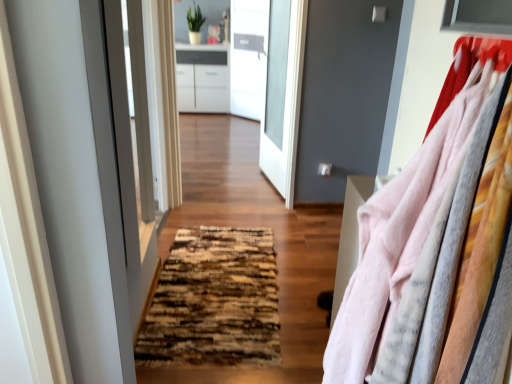
Question: From the image's perspective, does matte white screen door at center appear higher than brown textured rug at center?

Choices:
 (A) no
 (B) yes

Answer: (B)

Question: Is matte white screen door at center in contact with brown textured rug at center?

Choices:
 (A) no
 (B) yes

Answer: (A)

Question: Is matte white screen door at center at the right side of brown textured rug at center?

Choices:
 (A) yes
 (B) no

Answer: (B)

Question: Is matte white screen door at center smaller than brown textured rug at center?

Choices:
 (A) yes
 (B) no

Answer: (B)

Question: Does matte white screen door at center have a greater height compared to brown textured rug at center?

Choices:
 (A) yes
 (B) no

Answer: (A)

Question: Would you say fluffy pink sweater at right is to the left or to the right of matte white screen door at center in the picture?

Choices:
 (A) right
 (B) left

Answer: (A)

Question: Is point (425, 170) closer or farther from the camera than point (125, 120)?

Choices:
 (A) farther
 (B) closer

Answer: (B)

Question: From the image's perspective, is fluffy pink sweater at right located above or below matte white screen door at center?

Choices:
 (A) below
 (B) above

Answer: (A)

Question: In terms of height, does fluffy pink sweater at right look taller or shorter compared to matte white screen door at center?

Choices:
 (A) short
 (B) tall

Answer: (A)

Question: From a real-world perspective, is fluffy pink sweater at right physically located above or below transparent glass door at center?

Choices:
 (A) below
 (B) above

Answer: (B)

Question: Considering the positions of fluffy pink sweater at right and transparent glass door at center in the image, is fluffy pink sweater at right wider or thinner than transparent glass door at center?

Choices:
 (A) thin
 (B) wide

Answer: (B)

Question: Relative to transparent glass door at center, is fluffy pink sweater at right in front or behind?

Choices:
 (A) front
 (B) behind

Answer: (A)

Question: Is point (379, 256) closer or farther from the camera than point (278, 115)?

Choices:
 (A) closer
 (B) farther

Answer: (A)

Question: Is brown textured rug at center to the left or to the right of transparent glass door at center in the image?

Choices:
 (A) left
 (B) right

Answer: (A)

Question: From a real-world perspective, is brown textured rug at center above or below transparent glass door at center?

Choices:
 (A) below
 (B) above

Answer: (A)